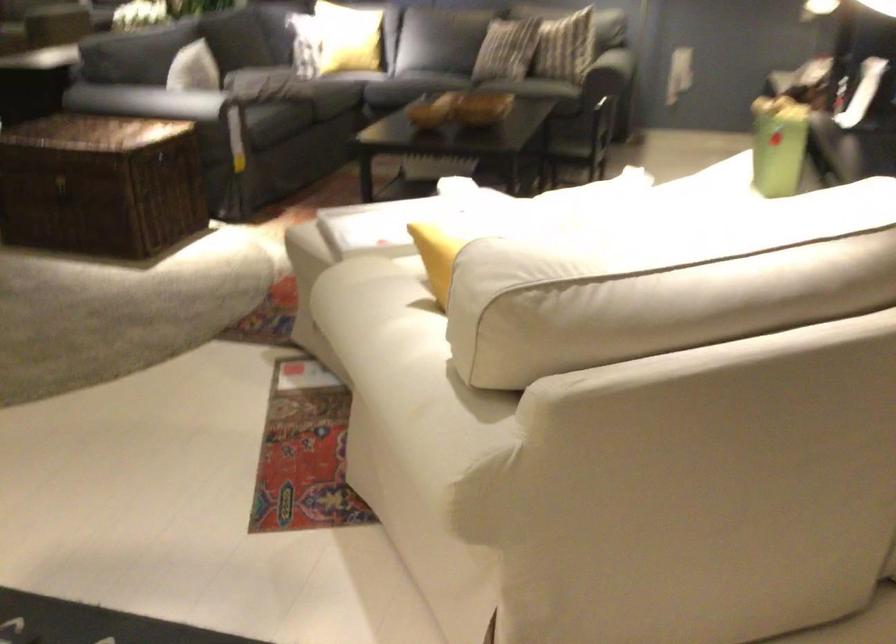
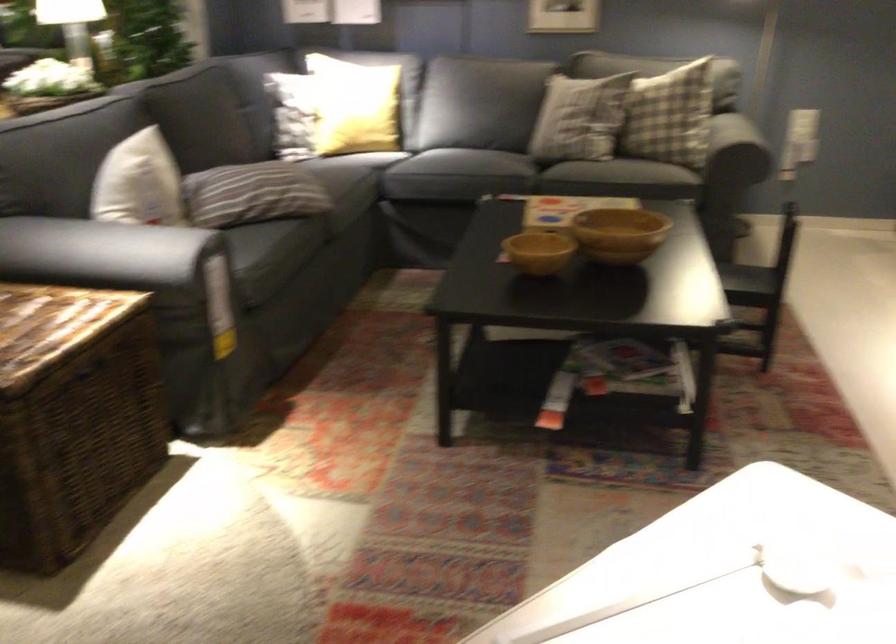
Question: Which direction would the cameraman need to move to produce the second image? Reply with the corresponding letter.

Choices:
 (A) Left
 (B) Right
 (C) Forward
 (D) Backward

Answer: (C)